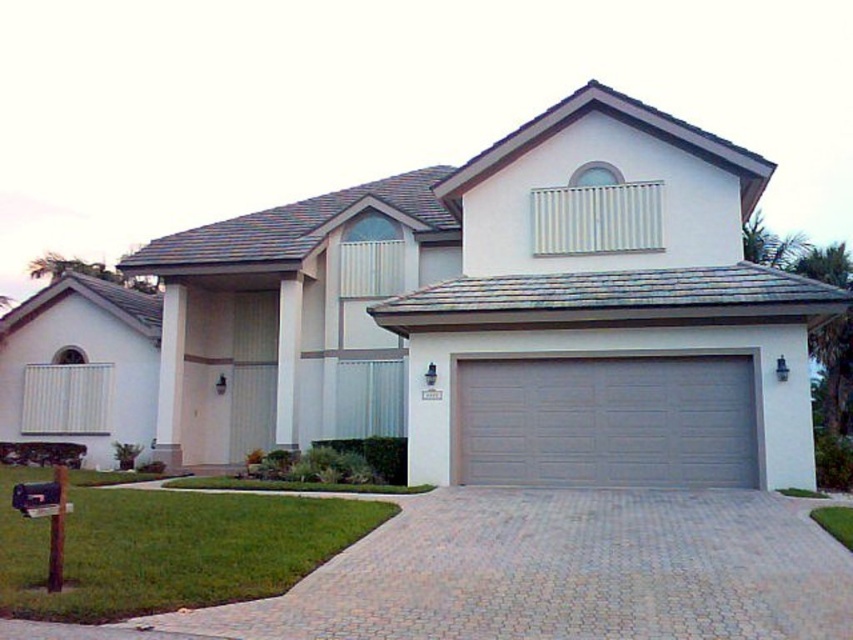
Who is positioned more to the left, paved brick driveway at center or green grass at lower left?

green grass at lower left

Is point (311, 634) in front of point (103, 536)?

Yes, it is.

Where is `paved brick driveway at center`? paved brick driveway at center is located at coordinates (563, 572).

Identify the location of paved brick driveway at center. The image size is (853, 640). (563, 572).

Does gray textured garage door at center appear on the right side of green grass at lower left?

Yes, gray textured garage door at center is to the right of green grass at lower left.

Does point (738, 390) lie behind point (183, 593)?

Yes, point (738, 390) is farther from viewer.

Image resolution: width=853 pixels, height=640 pixels. In order to click on gray textured garage door at center in this screenshot , I will do tap(607, 420).

Between paved brick driveway at center and gray textured garage door at center, which one has more height?

With more height is gray textured garage door at center.

Is paved brick driveway at center closer to camera compared to gray textured garage door at center?

Yes, it is in front of gray textured garage door at center.

Is point (448, 605) farther from camera compared to point (612, 392)?

No.

Locate an element on the screen. paved brick driveway at center is located at coordinates (563, 572).